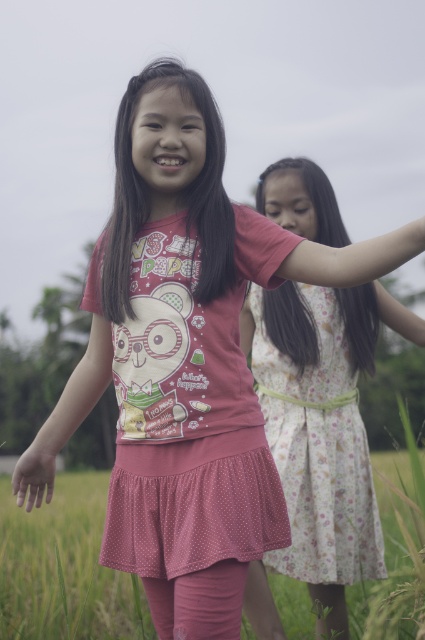
You are standing in a grassy field and see a girl wearing a pink polka dot dress at center. If you want to take a closer look at the dress, how many steps do you need to take to reach it if each step covers 2.5 feet?

The pink polka dot dress at center is 7.88 feet away from viewer. Since each step covers 2.5 feet, you would need to take 4 steps to cover approximately 10 feet, which is slightly more than the required distance. However, since you can adjust your last step, 3 steps would cover 7.5 feet, leaving 0.38 feet remaining. Therefore, you would need to take 3 full steps and a small step to reach the dress.